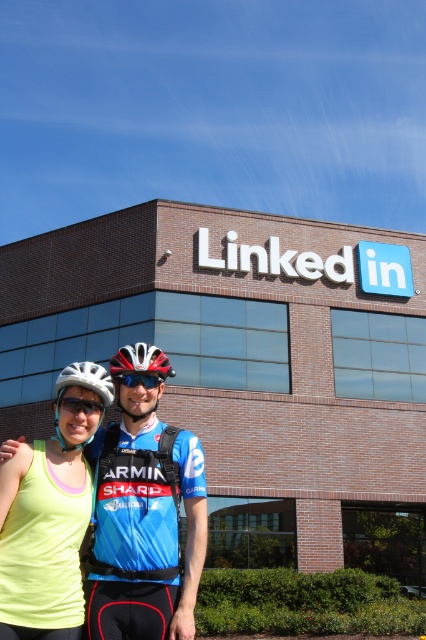
Question: Which point appears farthest from the camera in this image?

Choices:
 (A) (109, 358)
 (B) (20, 572)

Answer: (A)

Question: Observing the image, what is the correct spatial positioning of blue jersey at center in reference to white matte bicycle helmet at center?

Choices:
 (A) below
 (B) above

Answer: (A)

Question: Does matte yellow tank top at center appear under shiny red helmet at center?

Choices:
 (A) no
 (B) yes

Answer: (B)

Question: Among these points, which one is nearest to the camera?

Choices:
 (A) (149, 376)
 (B) (63, 387)
 (C) (192, 534)
 (D) (94, 403)

Answer: (C)

Question: Which object is the closest to the shiny red helmet at center?

Choices:
 (A) clear plastic goggles at center
 (B) transparent plastic goggles at center
 (C) blue jersey at center
 (D) matte yellow tank top at center

Answer: (B)

Question: Is clear plastic goggles at center behind transparent plastic goggles at center?

Choices:
 (A) no
 (B) yes

Answer: (A)